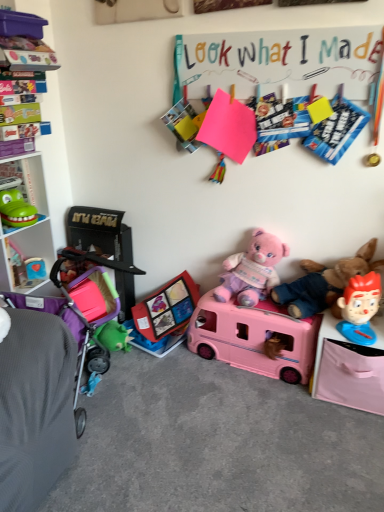
The image size is (384, 512). Find the location of `purple fabric baby carriage at left`. purple fabric baby carriage at left is located at coordinates (79, 306).

This screenshot has height=512, width=384. Find the location of `blue fabric toy at left, arranged as the 2th toy when viewed from the left`. blue fabric toy at left, arranged as the 2th toy when viewed from the left is located at coordinates (35, 268).

What do you see at coordinates (323, 283) in the screenshot? Image resolution: width=384 pixels, height=512 pixels. I see `soft pink plush at right, positioned as the second teddy bear in left-to-right order` at bounding box center [323, 283].

Where is `purple fabric baby carriage at left`? purple fabric baby carriage at left is located at coordinates (79, 306).

How much distance is there between green rubbery toy at left, which is the fourth toy in bottom-to-top order, and pink plastic toy bus at center, marked as the first toy in a bottom-to-top arrangement?

green rubbery toy at left, which is the fourth toy in bottom-to-top order, is 1.05 meters away from pink plastic toy bus at center, marked as the first toy in a bottom-to-top arrangement.

Is green rubbery toy at left, which is the fourth toy in bottom-to-top order, shorter than pink plastic toy bus at center, placed as the 3th toy when sorted from left to right?

Indeed, green rubbery toy at left, which is the fourth toy in bottom-to-top order, has a lesser height compared to pink plastic toy bus at center, placed as the 3th toy when sorted from left to right.

From the image's perspective, between green rubbery toy at left, arranged as the 4th toy when viewed from the right, and pink plastic toy bus at center, the second toy from the right, which one is located above?

From the image's view, green rubbery toy at left, arranged as the 4th toy when viewed from the right, is above.

Considering the sizes of objects green rubbery toy at left, which is the fourth toy in bottom-to-top order, and pink plastic toy bus at center, placed as the 3th toy when sorted from left to right, in the image provided, who is wider, green rubbery toy at left, which is the fourth toy in bottom-to-top order, or pink plastic toy bus at center, placed as the 3th toy when sorted from left to right,?

green rubbery toy at left, which is the fourth toy in bottom-to-top order, is wider.

Considering the positions of point (371, 298) and point (71, 254), is point (371, 298) closer or farther from the camera than point (71, 254)?

Clearly, point (371, 298) is closer to the camera than point (71, 254).

Which is correct: smooth red plastic toy at right, which appears as the 2th toy when ordered from the bottom, is inside purple fabric baby carriage at left, or outside of it?

smooth red plastic toy at right, which appears as the 2th toy when ordered from the bottom, is not inside purple fabric baby carriage at left, it's outside.

Between smooth red plastic toy at right, which appears as the 2th toy when ordered from the bottom, and purple fabric baby carriage at left, which one is positioned behind?

smooth red plastic toy at right, which appears as the 2th toy when ordered from the bottom.

From a real-world perspective, between smooth red plastic toy at right, the third toy in the top-to-bottom sequence, and purple fabric baby carriage at left, who is vertically higher?

From a 3D spatial view, smooth red plastic toy at right, the third toy in the top-to-bottom sequence, is above.

Based on their sizes in the image, would you say green rubbery toy at left, which is the fourth toy in bottom-to-top order, is bigger or smaller than white plastic cabinet at left?

Considering their sizes, green rubbery toy at left, which is the fourth toy in bottom-to-top order, takes up less space than white plastic cabinet at left.

Is green rubbery toy at left, arranged as the 4th toy when viewed from the right, positioned beyond the bounds of white plastic cabinet at left?

No, green rubbery toy at left, arranged as the 4th toy when viewed from the right, is not outside of white plastic cabinet at left.

Consider the image. Is green rubbery toy at left, arranged as the 4th toy when viewed from the right, to the left of white plastic cabinet at left from the viewer's perspective?

No, green rubbery toy at left, arranged as the 4th toy when viewed from the right, is not to the left of white plastic cabinet at left.

Considering the sizes of objects white plastic cabinet at left and colored paperboard at upper center in the image provided, who is bigger, white plastic cabinet at left or colored paperboard at upper center?

With larger size is white plastic cabinet at left.

Where is `bulletin board in front of the white plastic cabinet at left`? This screenshot has width=384, height=512. bulletin board in front of the white plastic cabinet at left is located at coordinates (279, 63).

Considering the positions of points (42, 248) and (275, 73), is point (42, 248) closer to camera compared to point (275, 73)?

No, it is behind (275, 73).

Is white plastic cabinet at left facing away from colored paperboard at upper center?

That's not correct — white plastic cabinet at left is not looking away from colored paperboard at upper center.

What's the angular difference between soft pink plush at right, the 1th teddy bear when ordered from right to left, and white plastic cabinet at left's facing directions?

90.6 degrees.

Considering the relative sizes of soft pink plush at right, the 1th teddy bear when ordered from right to left, and white plastic cabinet at left in the image provided, is soft pink plush at right, the 1th teddy bear when ordered from right to left, wider than white plastic cabinet at left?

In fact, soft pink plush at right, the 1th teddy bear when ordered from right to left, might be narrower than white plastic cabinet at left.

Considering the positions of point (326, 273) and point (45, 295), is point (326, 273) closer or farther from the camera than point (45, 295)?

Point (326, 273) appears to be farther away from the viewer than point (45, 295).

In the scene shown: Visually, is soft pink plush at right, the 1th teddy bear when ordered from right to left, positioned to the left or to the right of white plastic cabinet at left?

Clearly, soft pink plush at right, the 1th teddy bear when ordered from right to left, is on the right of white plastic cabinet at left in the image.

In the scene shown: Can you confirm if purple fabric baby carriage at left is wider than smooth red plastic toy at right, which appears as the 2th toy when ordered from the bottom?

Correct, the width of purple fabric baby carriage at left exceeds that of smooth red plastic toy at right, which appears as the 2th toy when ordered from the bottom.

Based on the photo, is purple fabric baby carriage at left bigger than smooth red plastic toy at right, the first toy in the right-to-left sequence?

Yes, purple fabric baby carriage at left is bigger than smooth red plastic toy at right, the first toy in the right-to-left sequence.

Between purple fabric baby carriage at left and smooth red plastic toy at right, which is the fourth toy from left to right, which one appears on the left side from the viewer's perspective?

purple fabric baby carriage at left is more to the left.

Can we say purple fabric baby carriage at left lies outside smooth red plastic toy at right, the third toy in the top-to-bottom sequence?

Indeed, purple fabric baby carriage at left is completely outside smooth red plastic toy at right, the third toy in the top-to-bottom sequence.

Is soft pink plush at right, the 1th teddy bear when ordered from right to left, positioned with its back to smooth red plastic toy at right, which appears as the 2th toy when ordered from the bottom?

soft pink plush at right, the 1th teddy bear when ordered from right to left, is not turned away from smooth red plastic toy at right, which appears as the 2th toy when ordered from the bottom.

Find the location of `toy that is the 1st one below the soft pink plush at right, positioned as the second teddy bear in left-to-right order (from a real-world perspective)`. toy that is the 1st one below the soft pink plush at right, positioned as the second teddy bear in left-to-right order (from a real-world perspective) is located at coordinates (360, 308).

Could you measure the distance between soft pink plush at right, positioned as the second teddy bear in left-to-right order, and smooth red plastic toy at right, which appears as the 2th toy when ordered from the bottom?

17.36 centimeters.

From a real-world perspective, is soft pink plush at right, the 1th teddy bear when ordered from right to left, over smooth red plastic toy at right, the third toy in the top-to-bottom sequence?

Yes, from a real-world perspective, soft pink plush at right, the 1th teddy bear when ordered from right to left, is above smooth red plastic toy at right, the third toy in the top-to-bottom sequence.

Where is `the 3rd toy directly beneath the green rubbery toy at left, which is the fourth toy in bottom-to-top order (from a real-world perspective)`? Image resolution: width=384 pixels, height=512 pixels. the 3rd toy directly beneath the green rubbery toy at left, which is the fourth toy in bottom-to-top order (from a real-world perspective) is located at coordinates (254, 337).

Image resolution: width=384 pixels, height=512 pixels. Identify the location of baby carriage in front of the smooth red plastic toy at right, the third toy in the top-to-bottom sequence. click(x=79, y=306).

Based on their spatial positions, is white plastic cabinet at left or pink plastic changing table at lower right closer to blue fabric toy at left, which ranks as the 2th toy in top-to-bottom order?

white plastic cabinet at left.

Which object lies nearer to the anchor point soft pink plush at right, positioned as the second teddy bear in left-to-right order, colored paperboard at upper center or pink plush teddy bear at center, positioned as the 1th teddy bear in left-to-right order?

pink plush teddy bear at center, positioned as the 1th teddy bear in left-to-right order.

Estimate the real-world distances between objects in this image. Which object is further from blue fabric toy at left, which ranks as the 2th toy in top-to-bottom order, pink plastic changing table at lower right or colored paperboard at upper center?

pink plastic changing table at lower right lies further to blue fabric toy at left, which ranks as the 2th toy in top-to-bottom order, than the other object.

Which object lies nearer to the anchor point white plastic cabinet at left, pink plastic changing table at lower right or pink plastic toy bus at center, placed as the 3th toy when sorted from left to right?

pink plastic toy bus at center, placed as the 3th toy when sorted from left to right.

When comparing their distances from pink plastic changing table at lower right, does pink plastic toy bus at center, placed as the 3th toy when sorted from left to right, or colored paperboard at upper center seem closer?

pink plastic toy bus at center, placed as the 3th toy when sorted from left to right, is closer to pink plastic changing table at lower right.

Based on their spatial positions, is colored paperboard at upper center or blue fabric toy at left, arranged as the 2th toy when viewed from the left, closer to soft pink plush at right, positioned as the second teddy bear in left-to-right order?

colored paperboard at upper center is closer to soft pink plush at right, positioned as the second teddy bear in left-to-right order.

Looking at the image, which one is located further to pink plush teddy bear at center, positioned as the 1th teddy bear in left-to-right order, green rubbery toy at left, positioned as the 1th toy in top-to-bottom order, or soft pink plush at right, positioned as the second teddy bear in left-to-right order?

Based on the image, green rubbery toy at left, positioned as the 1th toy in top-to-bottom order, appears to be further to pink plush teddy bear at center, positioned as the 1th teddy bear in left-to-right order.

Considering their positions, is white plastic cabinet at left positioned closer to pink plastic toy bus at center, marked as the first toy in a bottom-to-top arrangement, than purple fabric baby carriage at left?

The object closer to pink plastic toy bus at center, marked as the first toy in a bottom-to-top arrangement, is purple fabric baby carriage at left.

This screenshot has height=512, width=384. I want to click on teddy bear located between white plastic cabinet at left and colored paperboard at upper center in the left-right direction, so click(x=252, y=270).

Where is `bulletin board between white plastic cabinet at left and smooth red plastic toy at right, the third toy in the top-to-bottom sequence`? The image size is (384, 512). bulletin board between white plastic cabinet at left and smooth red plastic toy at right, the third toy in the top-to-bottom sequence is located at coordinates (279, 63).

Identify the location of bulletin board located between blue fabric toy at left, which ranks as the 2th toy in top-to-bottom order, and pink plastic changing table at lower right in the left-right direction. This screenshot has width=384, height=512. (279, 63).

This screenshot has height=512, width=384. In order to click on teddy bear situated between green rubbery toy at left, arranged as the 4th toy when viewed from the right, and colored paperboard at upper center from left to right in this screenshot , I will do `click(252, 270)`.